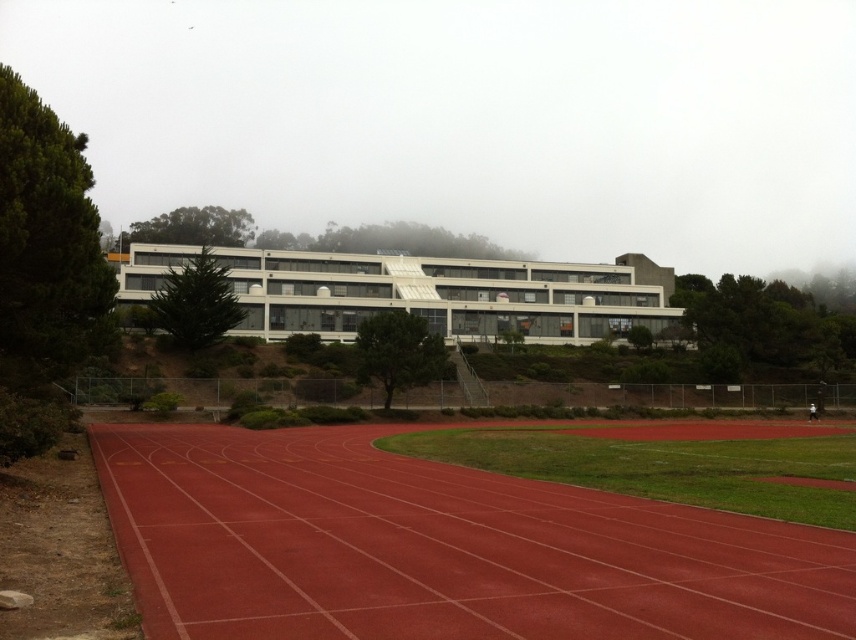
You are standing at the point with coordinates (438, 548) in the image of the outdoor sports facility. What surface are you currently standing on?

The point (438, 548) is on the rubber running track at center, so you are standing on the rubber running track.

You are an athlete standing at the starting line of the rubber running track at center. If you need to quickly retrieve your water bottle placed exactly 7 meters away from the track, which direction should you move to reach it?

The rubber running track at center is 7.08 meters away from the viewer. Since the water bottle is placed exactly 7 meters away from the track, you should move towards the direction away from the track to reach it, as the distance from the viewer to the track is slightly more than the required 7 meters.

You are a drone operator trying to capture aerial footage of the rubber running track at center and the white matte building at center. Based on their heights, which object would require you to ascend higher to fully capture in your footage?

The white matte building at center requires ascending higher because it has a greater height than the rubber running track at center.